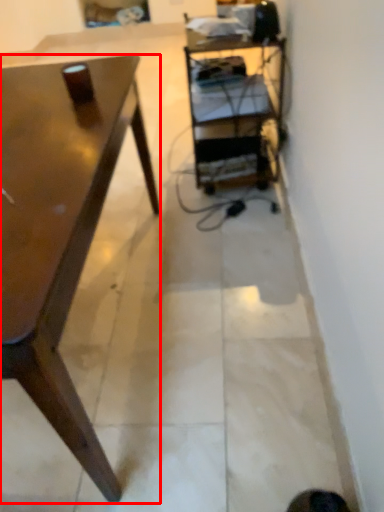
Question: From the image, what is the correct spatial relationship of desk (annotated by the red box) in relation to shelf?

Choices:
 (A) left
 (B) right

Answer: (A)